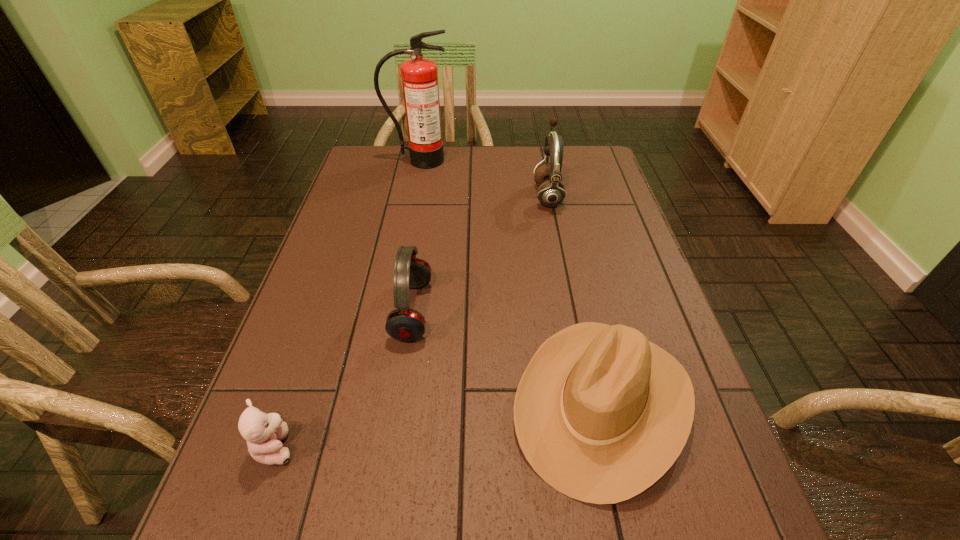
The image size is (960, 540). I want to click on empty space that is in between the farther earphone and the nearer earphone, so click(x=480, y=253).

Where is `unoccupied position between the second tallest object and the fire extinguisher`? This screenshot has height=540, width=960. unoccupied position between the second tallest object and the fire extinguisher is located at coordinates (483, 178).

Find the location of a particular element. Image resolution: width=960 pixels, height=540 pixels. unoccupied area between the taller earphone and the tallest object is located at coordinates (483, 178).

Identify the location of empty space between the teddy bear and the fourth tallest object. This screenshot has height=540, width=960. (439, 424).

I want to click on free space between the nearer earphone and the farthest object, so click(416, 236).

The width and height of the screenshot is (960, 540). In order to click on empty space that is in between the shorter earphone and the taller earphone in this screenshot , I will do `click(480, 253)`.

I want to click on vacant area that lies between the shorter earphone and the farther earphone, so pyautogui.click(x=480, y=253).

Locate an element on the screen. The height and width of the screenshot is (540, 960). object that is the fourth closest one to the nearer earphone is located at coordinates (419, 75).

At what (x,y) coordinates should I click in order to perform the action: click on the fourth closest object to the leftmost object. Please return your answer as a coordinate pair (x, y). This screenshot has width=960, height=540. Looking at the image, I should click on (419, 75).

At what (x,y) coordinates should I click in order to perform the action: click on free location that satisfies the following two spatial constraints: 1. on the ear cups of the second shortest object; 2. on the right side of the left earphone. Please return your answer as a coordinate pair (x, y). This screenshot has width=960, height=540. Looking at the image, I should click on (398, 402).